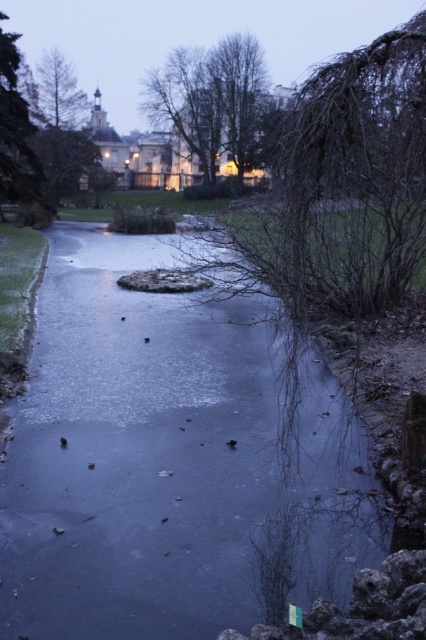
Looking at this image, which is more to the right, bare branches at center or green leafy tree at left?

bare branches at center is more to the right.

This screenshot has height=640, width=426. Describe the element at coordinates (334, 200) in the screenshot. I see `bare branches at center` at that location.

Identify the location of bare branches at center. This screenshot has height=640, width=426. (334, 200).

Is bare branches at center thinner than smooth brown tree at upper left?

In fact, bare branches at center might be wider than smooth brown tree at upper left.

Consider the image. Measure the distance between point [334,196] and camera.

Point [334,196] and camera are 9.94 meters apart.

This screenshot has width=426, height=640. In order to click on bare branches at center in this screenshot , I will do `click(334, 200)`.

Can you confirm if green leafy tree at center is positioned below green leafy tree at left?

Actually, green leafy tree at center is above green leafy tree at left.

Does point (229, 118) come in front of point (16, 125)?

That is False.

The height and width of the screenshot is (640, 426). In order to click on green leafy tree at center in this screenshot , I will do `click(213, 100)`.